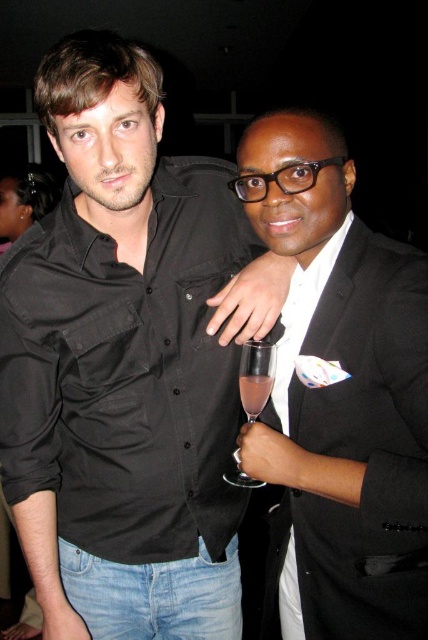
Does clear glass wine glass at right appear over pink translucent liquid at center?

Incorrect, clear glass wine glass at right is not positioned above pink translucent liquid at center.

Can you confirm if clear glass wine glass at right is wider than pink translucent liquid at center?

Yes.

You are a GUI agent. You are given a task and a screenshot of the screen. Output one action in this format:
    pyautogui.click(x=<x>, y=<y>)
    Task: Click on the clear glass wine glass at right
    
    Given the screenshot: What is the action you would take?
    (255, 376)

This screenshot has width=428, height=640. What do you see at coordinates (127, 365) in the screenshot?
I see `black matte shirt at center` at bounding box center [127, 365].

From the picture: Does black matte shirt at center lie in front of clear glass wine glass at right?

That is True.

Between point (133, 552) and point (261, 394), which one is positioned in front?

Point (261, 394) is in front.

You are a GUI agent. You are given a task and a screenshot of the screen. Output one action in this format:
    pyautogui.click(x=<x>, y=<y>)
    Task: Click on the black matte shirt at center
    The width and height of the screenshot is (428, 640).
    Given the screenshot: What is the action you would take?
    pyautogui.click(x=127, y=365)

Based on the photo, which is more to the right, black matte shirt at center or black satin suit at right?

black satin suit at right

Can you confirm if black matte shirt at center is positioned to the right of black satin suit at right?

No, black matte shirt at center is not to the right of black satin suit at right.

Which is in front, point (146, 484) or point (341, 376)?

Point (341, 376) is more forward.

Locate an element on the screen. Image resolution: width=428 pixels, height=640 pixels. black matte shirt at center is located at coordinates (127, 365).